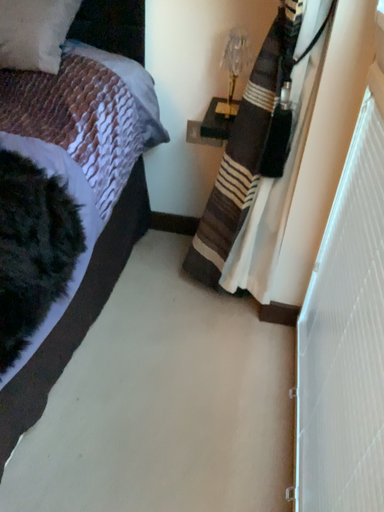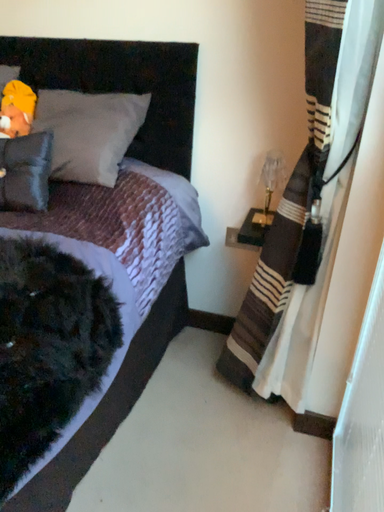
Question: Which way did the camera rotate in the video?

Choices:
 (A) rotated upward
 (B) rotated downward

Answer: (A)